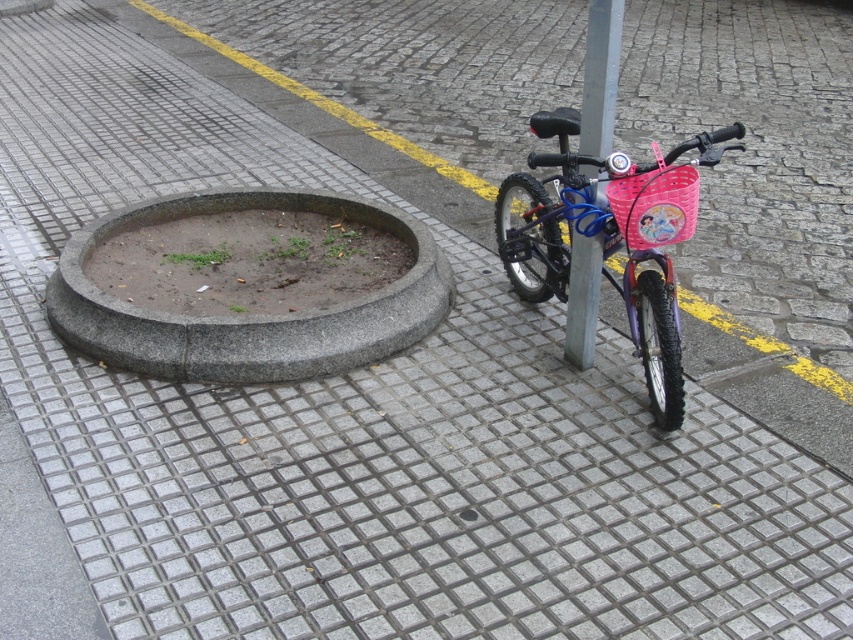
Question: Which object is farther from the camera taking this photo?

Choices:
 (A) gray concrete curb at center
 (B) metallic gray pole at center
 (C) pink plastic bicycle at center-right

Answer: (A)

Question: Estimate the real-world distances between objects in this image. Which object is farther from the metallic gray pole at center?

Choices:
 (A) pink plastic bicycle at center-right
 (B) gray concrete curb at center

Answer: (B)

Question: Considering the relative positions of pink plastic bicycle at center-right and metallic gray pole at center in the image provided, where is pink plastic bicycle at center-right located with respect to metallic gray pole at center?

Choices:
 (A) below
 (B) above

Answer: (B)

Question: Which object appears closest to the camera in this image?

Choices:
 (A) metallic gray pole at center
 (B) gray concrete curb at center
 (C) pink plastic bicycle at center-right

Answer: (C)

Question: Is gray concrete curb at center bigger than metallic gray pole at center?

Choices:
 (A) no
 (B) yes

Answer: (B)

Question: Does gray concrete curb at center come in front of pink plastic bicycle at center-right?

Choices:
 (A) yes
 (B) no

Answer: (B)